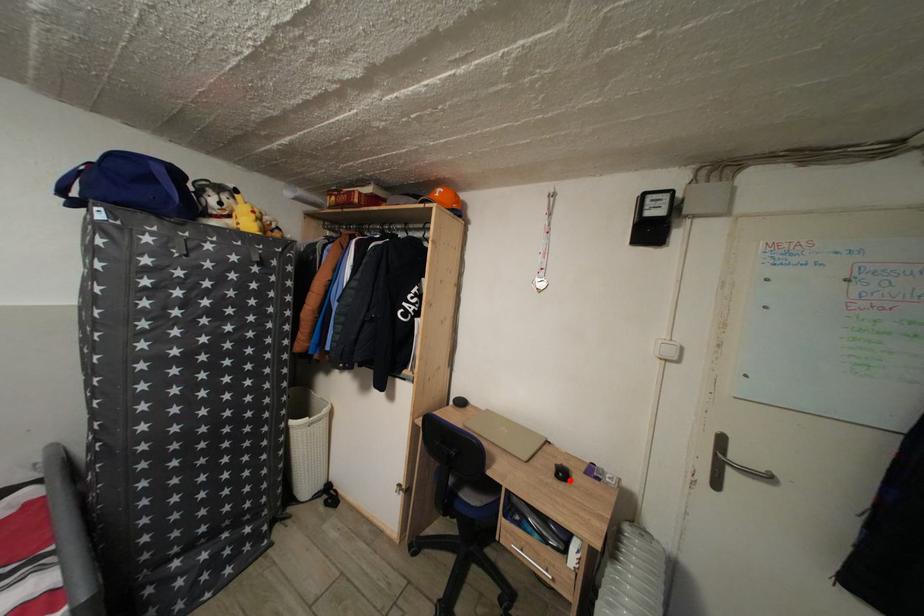
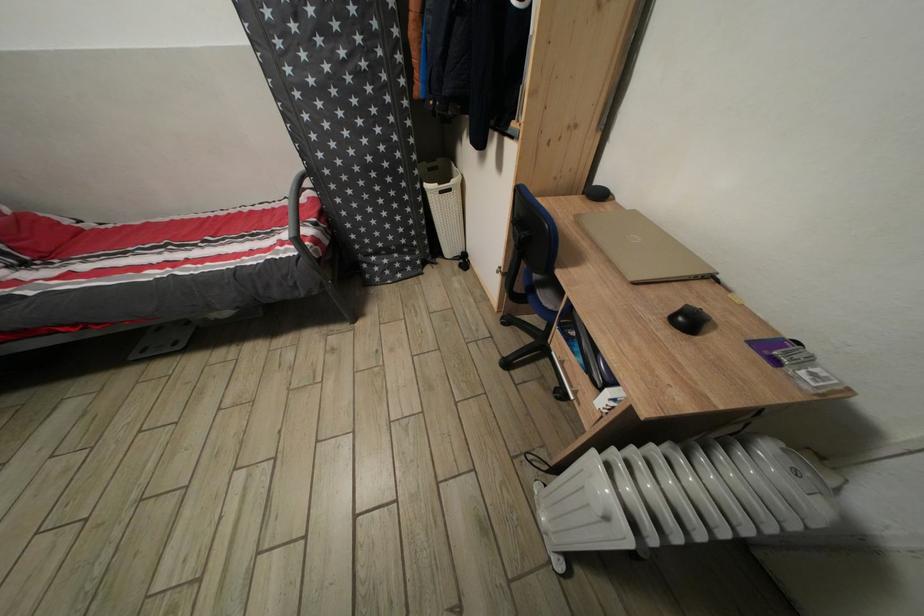
Locate, in the second image, the point that corresponds to the highlighted location in the first image.

(696, 328)